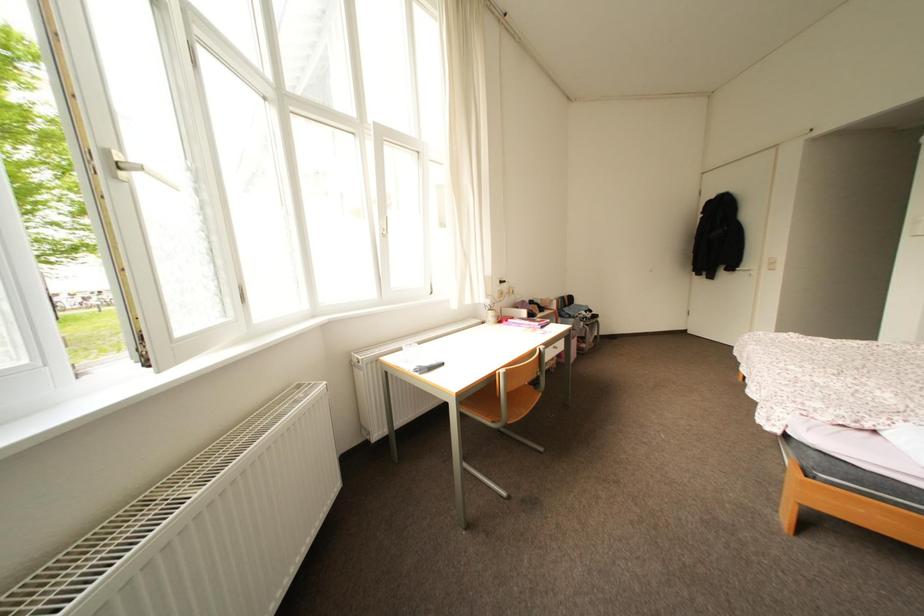
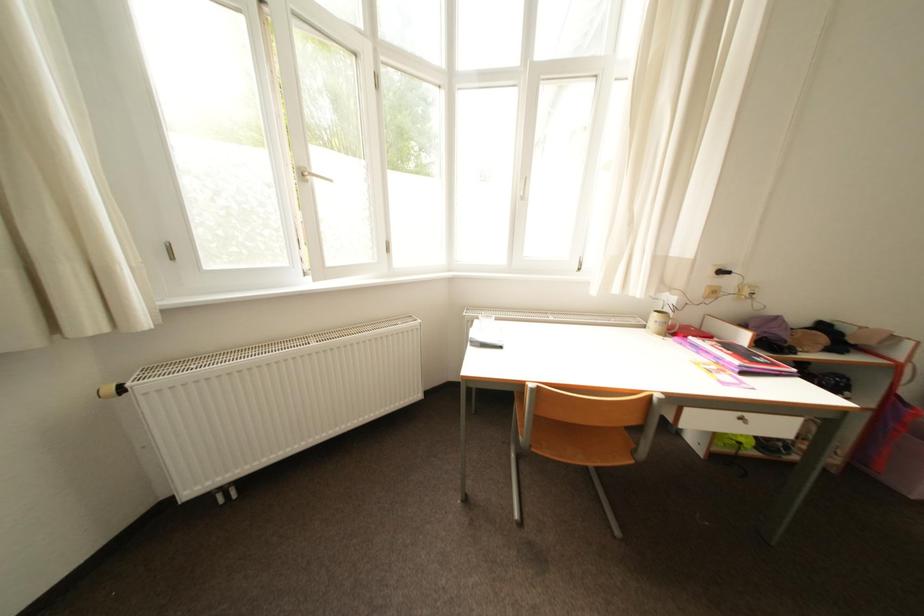
Question: Based on the continuous images, in which direction is the camera rotating? Reply with the corresponding letter.

Choices:
 (A) Left
 (B) Right
 (C) Up
 (D) Down

Answer: (A)